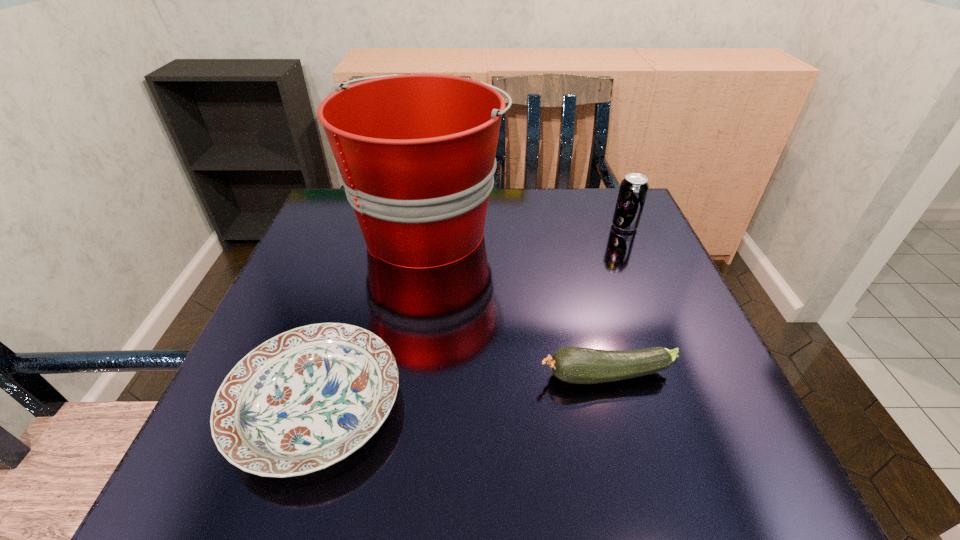
Image resolution: width=960 pixels, height=540 pixels. Identify the location of bucket that is positioned at the far edge. (416, 153).

In order to click on soda can located at the far edge in this screenshot , I will do `click(633, 190)`.

Where is `object that is at the near edge`? object that is at the near edge is located at coordinates (309, 397).

What are the coordinates of `bucket that is at the left edge` in the screenshot? It's located at (416, 153).

Image resolution: width=960 pixels, height=540 pixels. Find the location of `plate that is at the left edge`. plate that is at the left edge is located at coordinates (309, 397).

This screenshot has height=540, width=960. What are the coordinates of `soda can at the right edge` in the screenshot? It's located at (633, 190).

Identify the location of zucchini situated at the right edge. The width and height of the screenshot is (960, 540). (576, 365).

The image size is (960, 540). Identify the location of object that is at the far left corner. [416, 153].

Find the location of a particular element. The height and width of the screenshot is (540, 960). object that is at the near left corner is located at coordinates (309, 397).

Locate an element on the screen. This screenshot has width=960, height=540. object positioned at the far right corner is located at coordinates (633, 190).